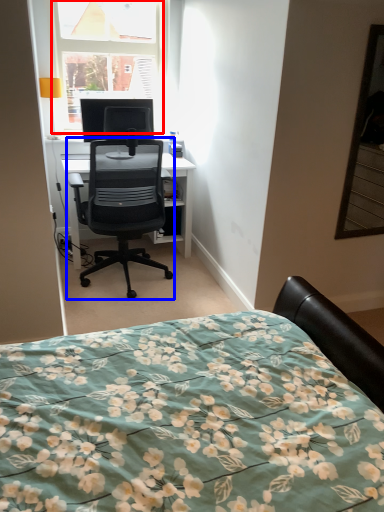
Question: Which object appears farthest to the camera in this image, window (highlighted by a red box) or chair (highlighted by a blue box)?

Choices:
 (A) window
 (B) chair

Answer: (A)